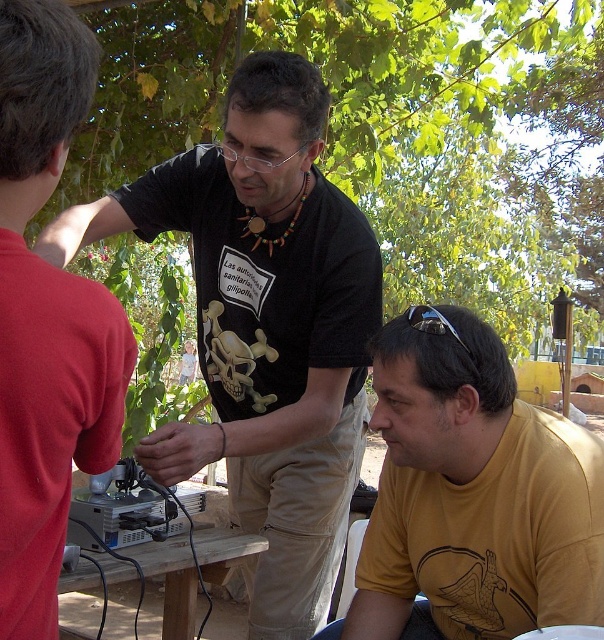
Question: Is the position of matte black shirt at center less distant than that of wooden table at center?

Choices:
 (A) no
 (B) yes

Answer: (B)

Question: Is black matte t-shirt at center above yellow matte shirt at lower right?

Choices:
 (A) yes
 (B) no

Answer: (A)

Question: Which of the following is the closest to the observer?

Choices:
 (A) (588, 525)
 (B) (74, 339)
 (C) (140, 557)

Answer: (B)

Question: Does black matte t-shirt at center appear over yellow matte shirt at lower right?

Choices:
 (A) no
 (B) yes

Answer: (B)

Question: Which point is closer to the camera?

Choices:
 (A) yellow matte shirt at lower right
 (B) wooden table at center

Answer: (A)

Question: Which object appears farthest from the camera in this image?

Choices:
 (A) wooden table at center
 (B) black matte t-shirt at center

Answer: (B)